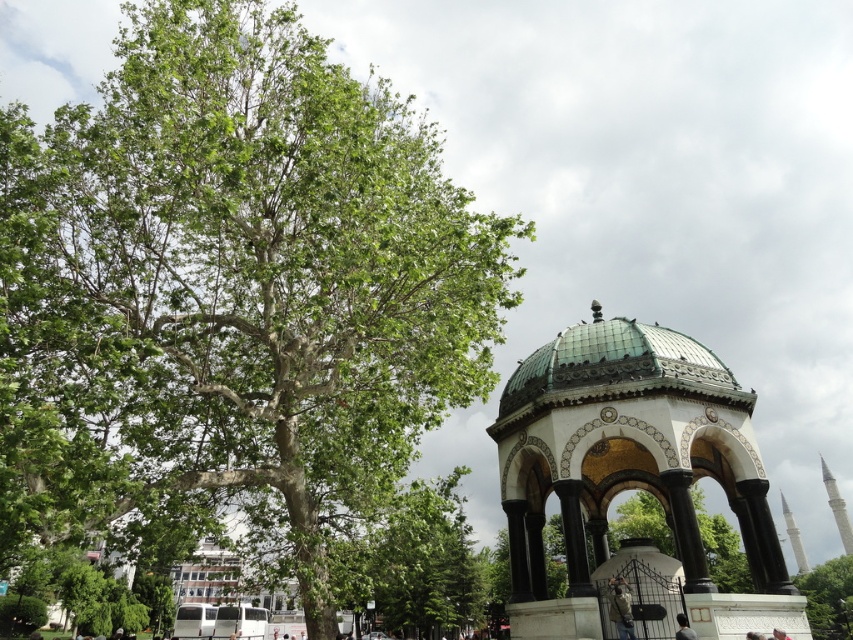
You are standing in the park and see the khaki fabric jacket at lower right and the gray fabric person at lower center. Which one is closer to you?

The khaki fabric jacket at lower right is closer to you because the gray fabric person at lower center is behind it.

You are standing in front of the pavilion and want to take a photo that includes both the point at coordinates (614, 595) and the point at coordinates (683, 637). Which point should you focus on first to ensure both are in focus?

You should focus on point (683, 637) first because it is closer to the camera than point (614, 595). By focusing on the closer point, the farther point will also be within the depth of field.